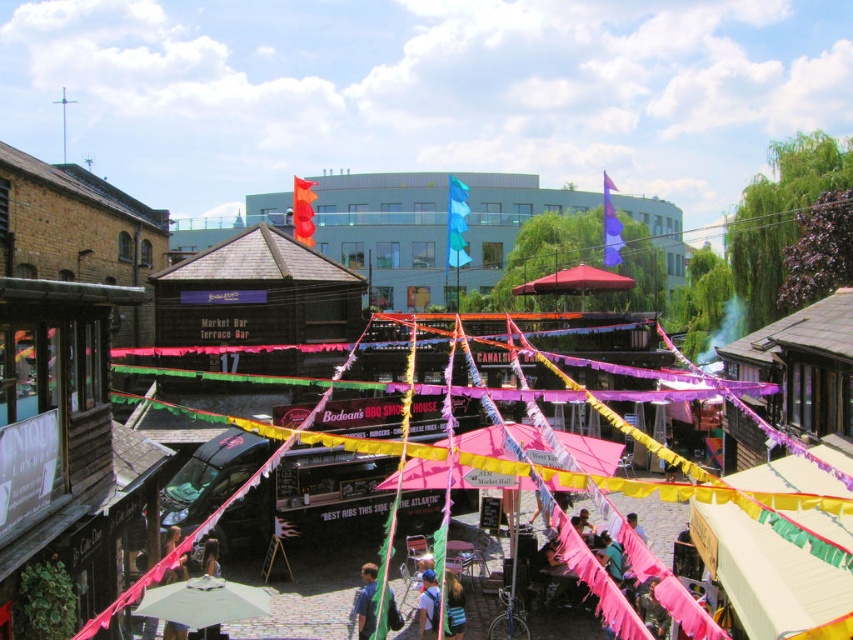
Question: Which object is positioned farthest from the white matte umbrella at lower center?

Choices:
 (A) purple fabric flag at upper center
 (B) blue fabric at center
 (C) blue fabric backpack at center

Answer: (A)

Question: Is blue fabric at center above orange fabric flag at center?

Choices:
 (A) no
 (B) yes

Answer: (A)

Question: Which of the following is the closest to the observer?

Choices:
 (A) (460, 636)
 (B) (216, 627)

Answer: (B)

Question: Does light brown wooden chair at center lie in front of light brown hair at lower center?

Choices:
 (A) yes
 (B) no

Answer: (B)

Question: Which of the following is the farthest from the observer?

Choices:
 (A) (450, 602)
 (B) (430, 609)

Answer: (B)

Question: Is blue fabric backpack at center below light brown hair at lower center?

Choices:
 (A) yes
 (B) no

Answer: (A)